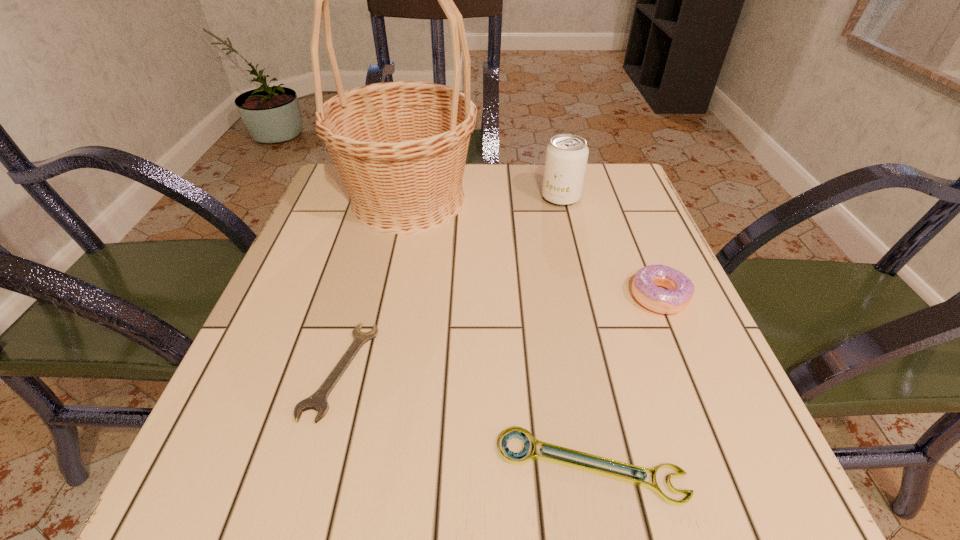
Where is `vacant area between the farther wrench and the right wrench`? vacant area between the farther wrench and the right wrench is located at coordinates (465, 418).

I want to click on vacant space that's between the farther wrench and the doughnut, so click(500, 333).

Where is `free space between the fourth shortest object and the left wrench`? free space between the fourth shortest object and the left wrench is located at coordinates (450, 284).

Where is `vacant point located between the doughnut and the right wrench`? The height and width of the screenshot is (540, 960). vacant point located between the doughnut and the right wrench is located at coordinates (625, 381).

The width and height of the screenshot is (960, 540). Identify the location of vacant space in between the second tallest object and the nearer wrench. (575, 332).

Where is `blank region between the basket and the soda can`? The image size is (960, 540). blank region between the basket and the soda can is located at coordinates (485, 199).

You are a GUI agent. You are given a task and a screenshot of the screen. Output one action in this format:
    pyautogui.click(x=<x>, y=<y>)
    Task: Click on the free point between the fourth farthest object and the third farthest object
    
    Given the screenshot: What is the action you would take?
    [500, 333]

The width and height of the screenshot is (960, 540). Identify the location of blank region between the third nearest object and the fourth shortest object. (611, 247).

Locate an element on the screen. blank region between the second tallest object and the nearer wrench is located at coordinates (575, 332).

Locate which object ranks in proximity to the tallest object. Please provide its 2D coordinates. Your answer should be formatted as a tuple, i.e. [(x, y)], where the tuple contains the x and y coordinates of a point satisfying the conditions above.

[(566, 157)]